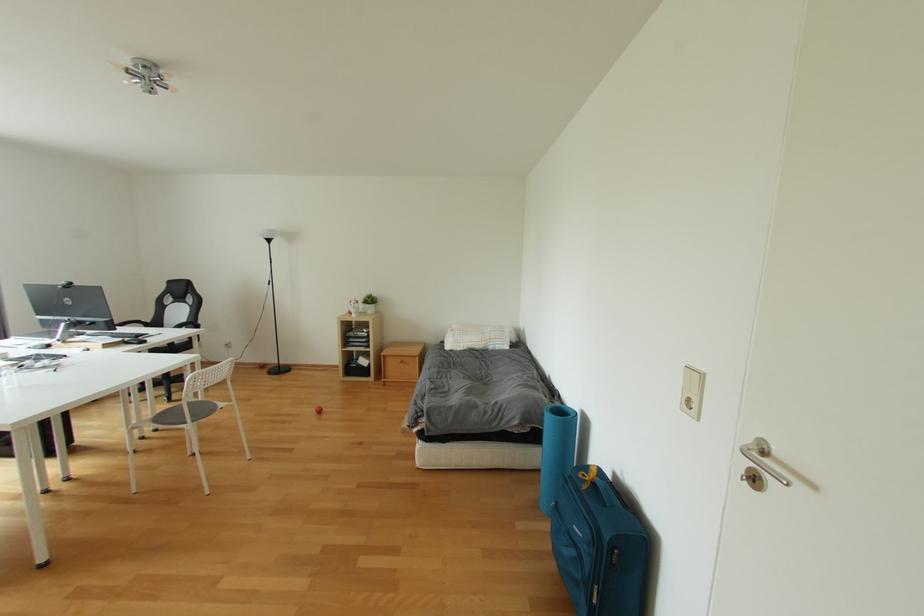
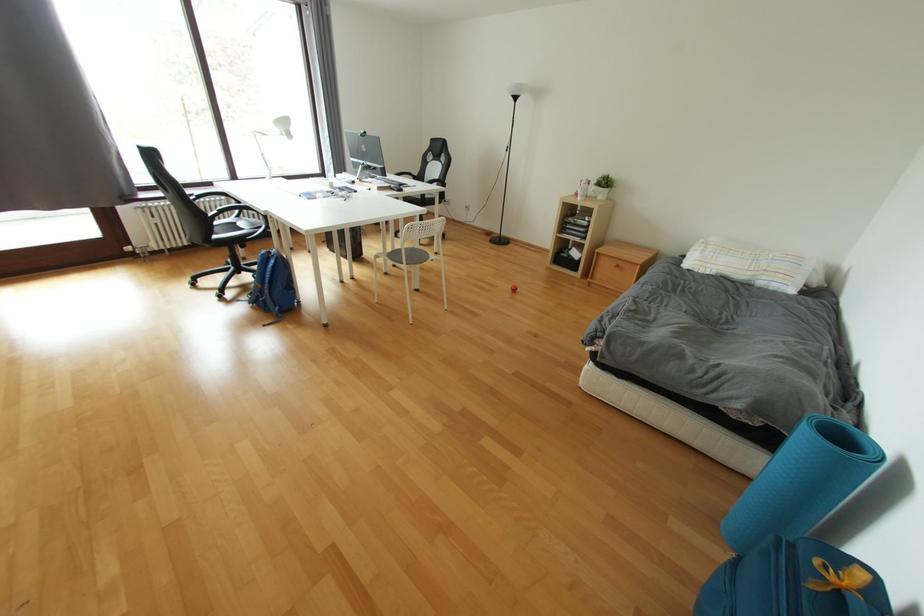
From the picture: The first image is from the beginning of the video and the second image is from the end. How did the camera likely rotate when shooting the video?

The camera's rotation is toward left-down.